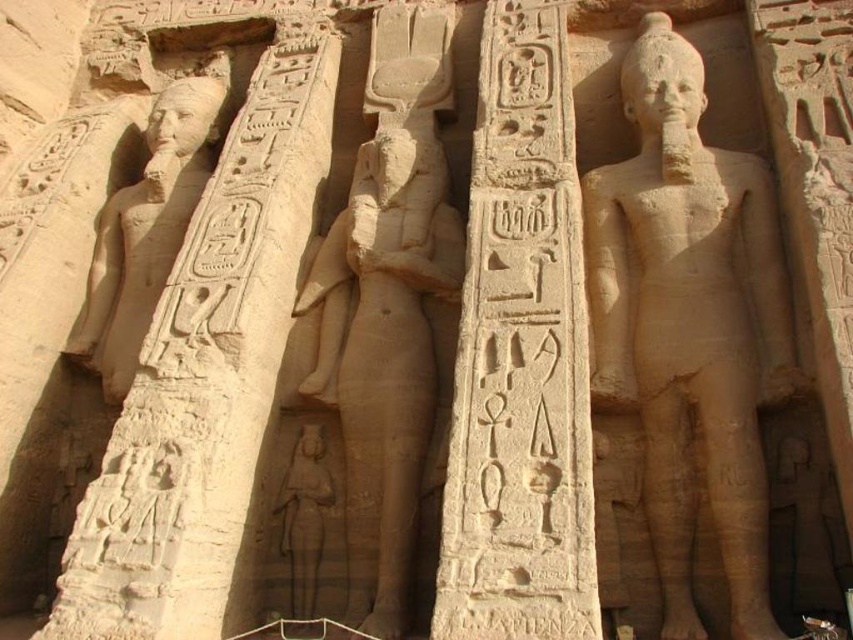
You are an archaeologist examining the sandstone statue at center and the sandstone statue at left in the temple. Which statue is taller?

The sandstone statue at center is taller than the sandstone statue at left.

You are an archaeologist examining the temple wall. You notice a specific point at coordinates (689, 326). What is located at this point?

The point at coordinates (689, 326) corresponds to the sandstone statue at center.

Based on the photo, you are standing in front of the ancient Egyptian temple and want to touch the point at coordinate (584, 589). Given that your arm can reach up to 2 meters, can you reach that point?

The point at coordinate (584, 589) is 30.12 meters away from the viewer. Since your arm can only reach up to 2 meters, you cannot reach that point.